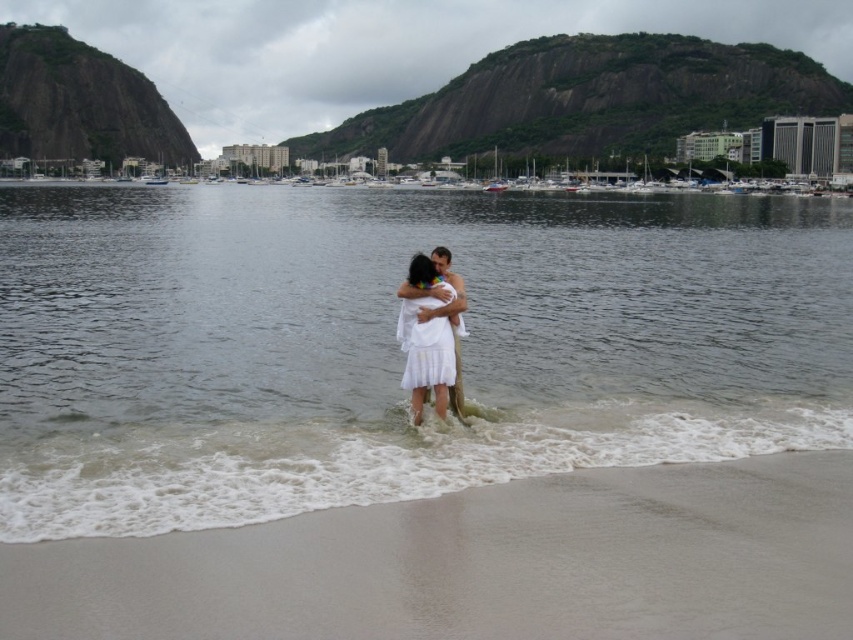
You are a photographer planning to capture the beach scene. You want to ensure that both the clear water at center and the sandy beach at lower center are visible in your shot. Given their sizes, which one should you focus on to include more of it in the frame?

The clear water at center is bigger than the sandy beach at lower center, so you should focus on including more of the clear water at center in the frame.

You are standing on the beach and want to take a photo of the clear water at center and the white satin dress at center. Which object should you focus on first to ensure it appears sharp in the photo?

The clear water at center is closer to the viewer than the white satin dress at center, so you should focus on the clear water at center first to ensure it appears sharp.

You are a photographer taking a picture of the sandy beach at lower center and the white satin dress at center. Based on their positions, which object is located to the right of the other?

The sandy beach at lower center is positioned on the right side of white satin dress at center, so the sandy beach at lower center is to the right of the white satin dress at center.